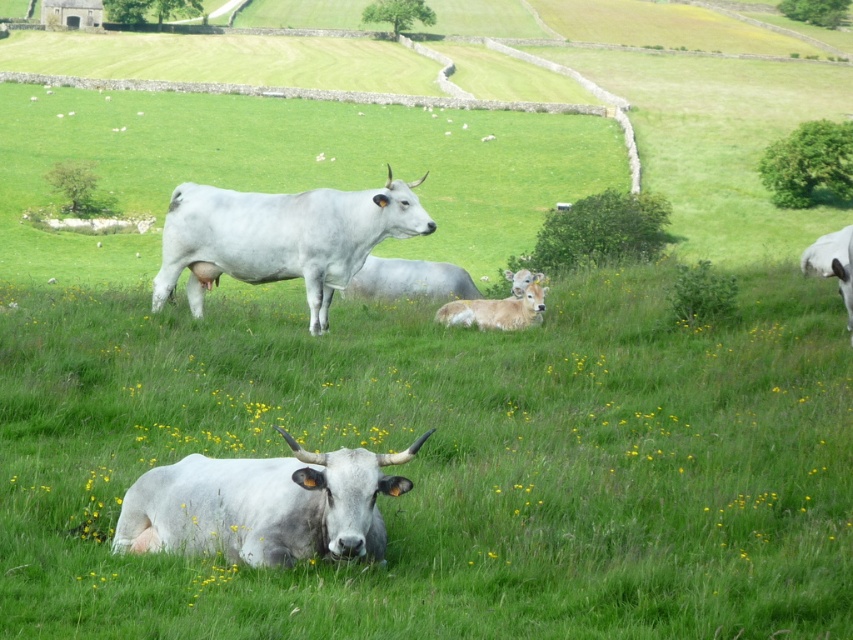
Which is above, white smooth bull at center or light brown fur at center?

Positioned higher is white smooth bull at center.

Can you confirm if white smooth bull at center is positioned below light brown fur at center?

Incorrect, white smooth bull at center is not positioned below light brown fur at center.

Who is more forward, (x=218, y=205) or (x=509, y=304)?

Point (x=218, y=205) is more forward.

Identify the location of white smooth bull at center. (281, 237).

Does green grass at center have a greater height compared to white smooth bull at center?

Incorrect, green grass at center's height is not larger of white smooth bull at center's.

Find the location of `green grass at center`. green grass at center is located at coordinates (447, 464).

Where is `green grass at center`? The height and width of the screenshot is (640, 853). green grass at center is located at coordinates (447, 464).

Between light brown fur at center and white smooth bull at right, which one appears on the right side from the viewer's perspective?

white smooth bull at right is more to the right.

Identify the location of light brown fur at center. This screenshot has height=640, width=853. (498, 307).

Find the location of a particular element. The image size is (853, 640). light brown fur at center is located at coordinates (498, 307).